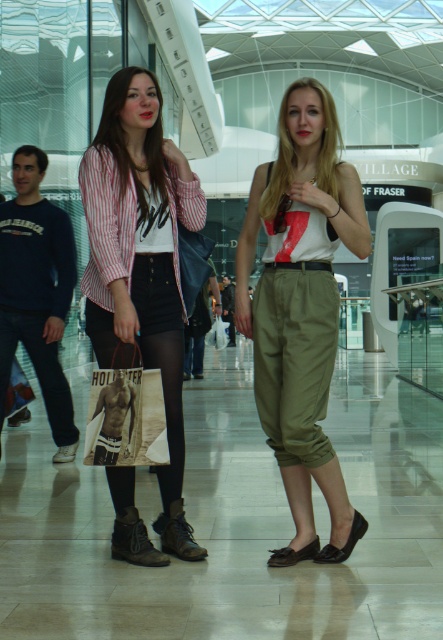
Is point (309, 464) positioned before point (97, 182)?

That is True.

Can you confirm if khaki cotton pants at center is positioned to the right of striped cotton shirt at center?

Correct, you'll find khaki cotton pants at center to the right of striped cotton shirt at center.

Is point (300, 420) closer to viewer compared to point (98, 278)?

Yes, it is in front of point (98, 278).

Find the location of `khaki cotton pants at center`. khaki cotton pants at center is located at coordinates (300, 308).